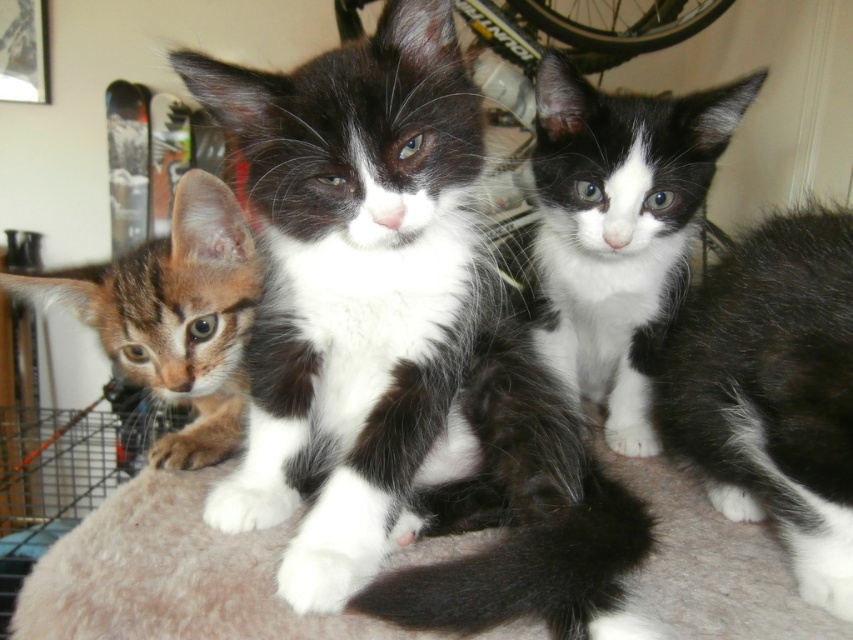
Question: Can you confirm if black and white fur at center is positioned to the right of white soft fur kitten at center?

Choices:
 (A) no
 (B) yes

Answer: (B)

Question: Among these objects, which one is farthest from the camera?

Choices:
 (A) white soft fur kitten at center
 (B) tabby fur kitten at left
 (C) black and white fur cat at center
 (D) black and white fur at center

Answer: (A)

Question: Does black and white fur cat at center come behind white soft fur kitten at center?

Choices:
 (A) no
 (B) yes

Answer: (A)

Question: Based on their relative distances, which object is farther from the black and white fur cat at center?

Choices:
 (A) white soft fur kitten at center
 (B) black and white fur at center
 (C) tabby fur kitten at left

Answer: (A)

Question: Which of these objects is positioned closest to the white soft fur kitten at center?

Choices:
 (A) tabby fur kitten at left
 (B) black and white fur at center
 (C) black and white fur cat at center

Answer: (B)

Question: Can you confirm if black and white fur cat at center is wider than black and white fur at center?

Choices:
 (A) no
 (B) yes

Answer: (B)